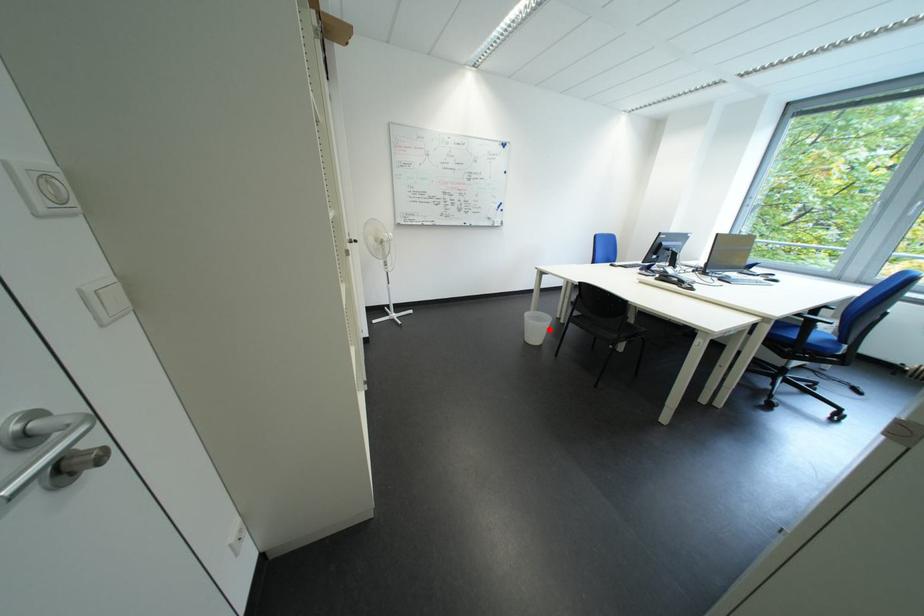
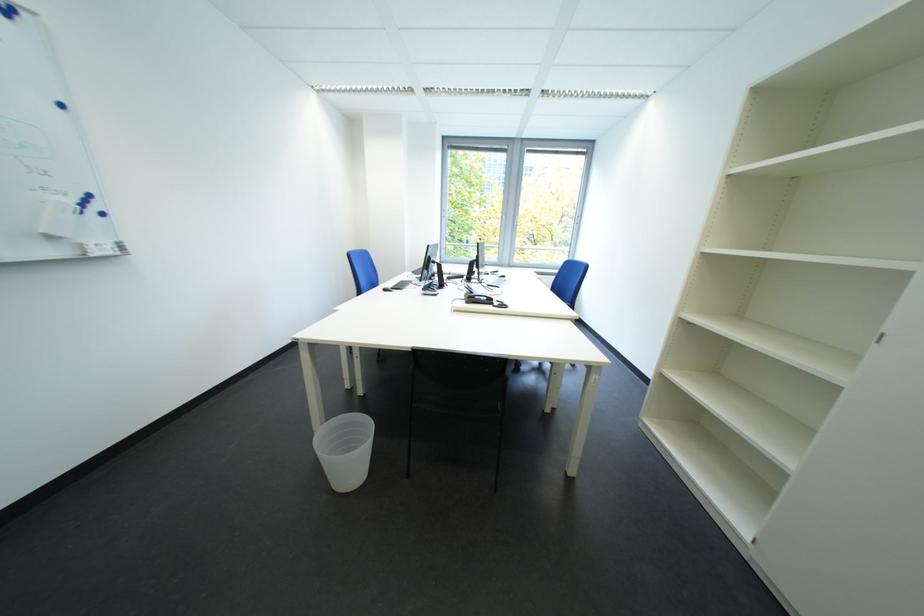
Locate, in the second image, the point that corresponds to the highlighted location in the first image.

(362, 455)